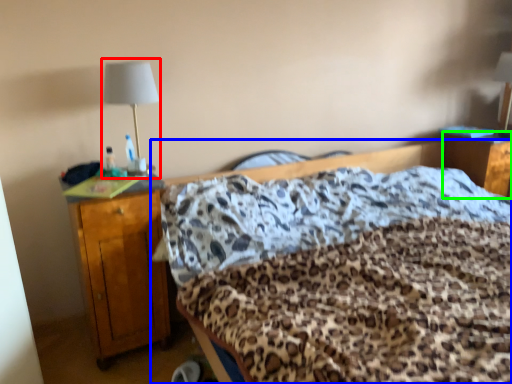
Question: Based on their relative distances, which object is farther from bedside lamp (highlighted by a red box)? Choose from bed (highlighted by a blue box) and nightstand (highlighted by a green box).

Choices:
 (A) bed
 (B) nightstand

Answer: (B)